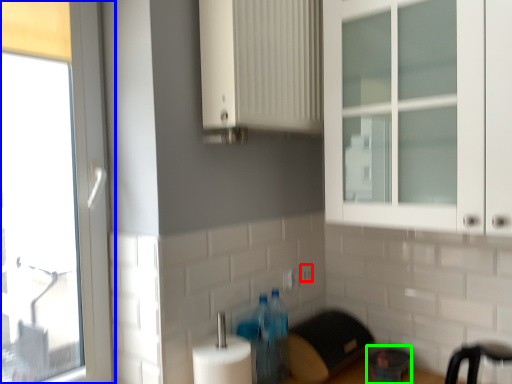
Question: Considering the real-world distances, which object is closest to electric outlet (highlighted by a red box)? window (highlighted by a blue box) or appliance (highlighted by a green box).

Choices:
 (A) window
 (B) appliance

Answer: (B)